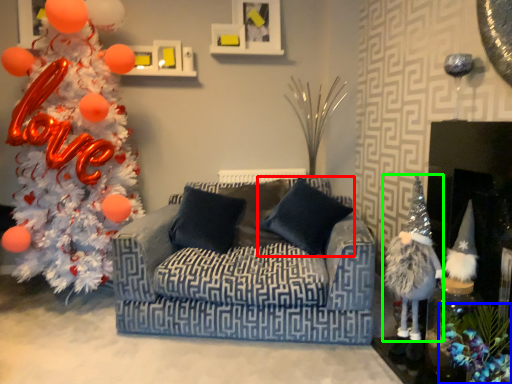
Question: Which object is positioned farthest from pillow (highlighted by a red box)? Select from christmas decoration (highlighted by a blue box) and toy (highlighted by a green box).

Choices:
 (A) christmas decoration
 (B) toy

Answer: (A)